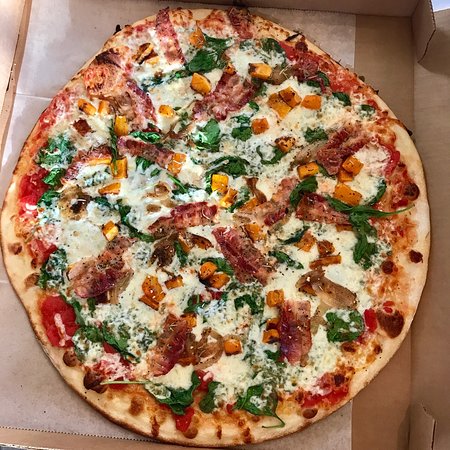
Identify the location of box. This screenshot has height=450, width=450. (424, 86).